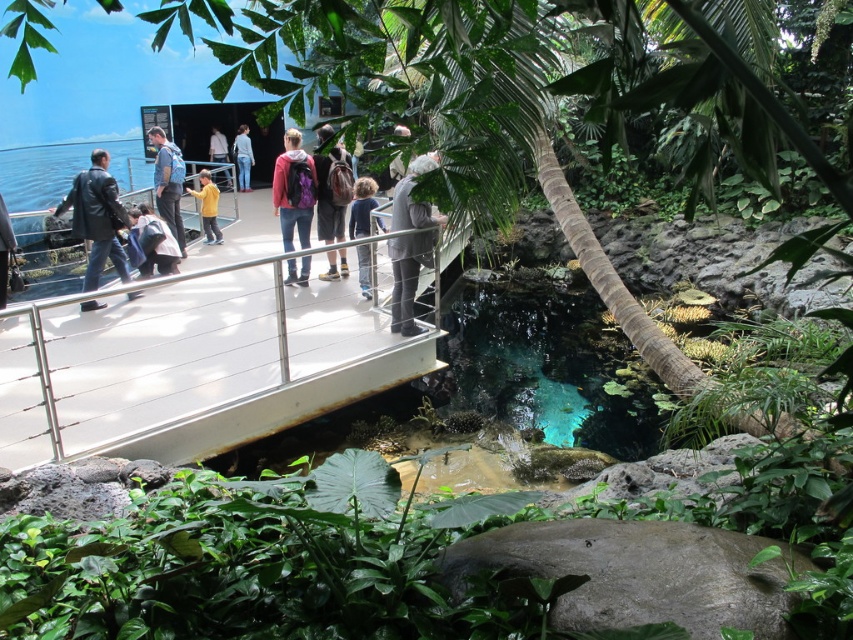
Does silver metallic rail at upper center have a greater height compared to matte black backpack at center?

Indeed, silver metallic rail at upper center has a greater height compared to matte black backpack at center.

Who is shorter, silver metallic rail at upper center or matte black backpack at center?

Standing shorter between the two is matte black backpack at center.

The image size is (853, 640). Describe the element at coordinates (193, 369) in the screenshot. I see `silver metallic rail at upper center` at that location.

This screenshot has width=853, height=640. I want to click on silver metallic rail at upper center, so [193, 369].

Can you confirm if leather jacket at left is thinner than dark blue shirt at center?

Incorrect, leather jacket at left's width is not less than dark blue shirt at center's.

Identify the location of leather jacket at left. This screenshot has width=853, height=640. (97, 218).

Does leather jacket at left have a lesser height compared to dark gray backpack at center?

In fact, leather jacket at left may be taller than dark gray backpack at center.

Is point (105, 168) closer to camera compared to point (149, 272)?

Yes, point (105, 168) is closer to viewer.

Which is behind, point (90, 257) or point (148, 244)?

The point (148, 244) is behind.

This screenshot has height=640, width=853. What are the coordinates of `leather jacket at left` in the screenshot? It's located at tap(97, 218).